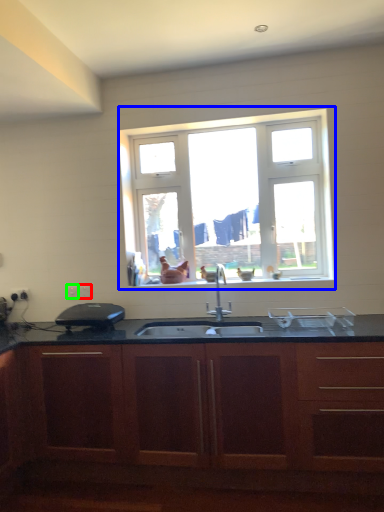
Question: Considering the real-world distances, which object is farthest from electric outlet (highlighted by a red box)? window (highlighted by a blue box) or electric outlet (highlighted by a green box)?

Choices:
 (A) window
 (B) electric outlet

Answer: (A)